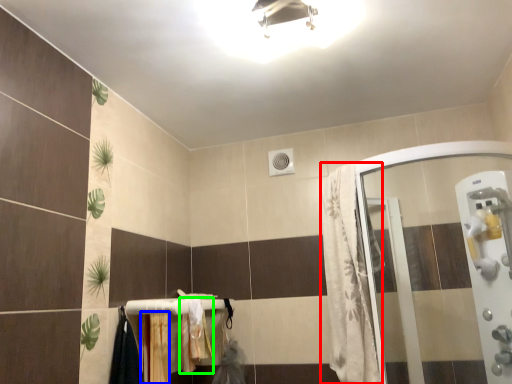
Question: Which is farther away from shower curtain (highlighted by a red box)? curtain (highlighted by a blue box) or bath towel (highlighted by a green box)?

Choices:
 (A) curtain
 (B) bath towel

Answer: (A)